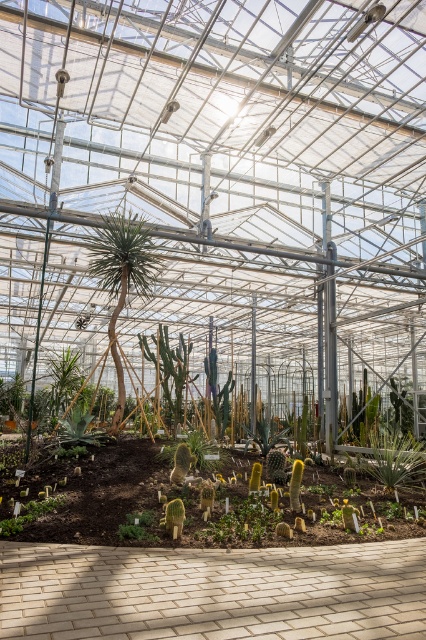
You are a gardener who needs to water two plants in the greenhouse. You are currently standing at the green leafy plant at center. The watering can you are holding has a range of 3 meters. Can you reach the green matte cactus at lower left without moving from your current position?

The distance between the green leafy plant at center and the green matte cactus at lower left is 4.46 meters. Since the watering can only has a range of 3 meters, you cannot reach the green matte cactus at lower left without moving.

You are standing inside the greenhouse and want to water the green leafy plant at center. If your watering can has a maximum reach of 5 meters, will you be able to water it without moving closer?

The green leafy plant at center is 6.23 meters away from the viewer, which exceeds the watering can reach of 5 meters. Therefore, you need to move closer to water it.